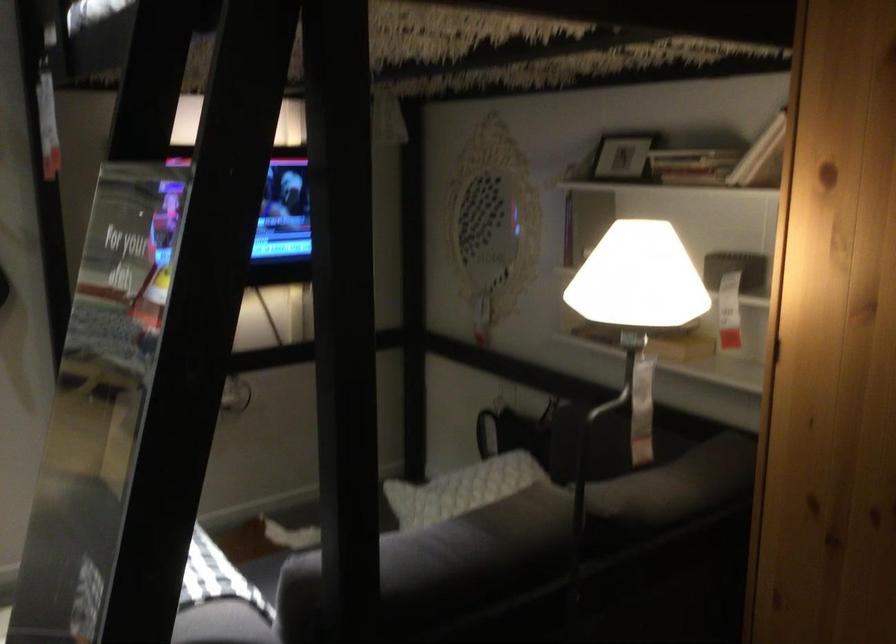
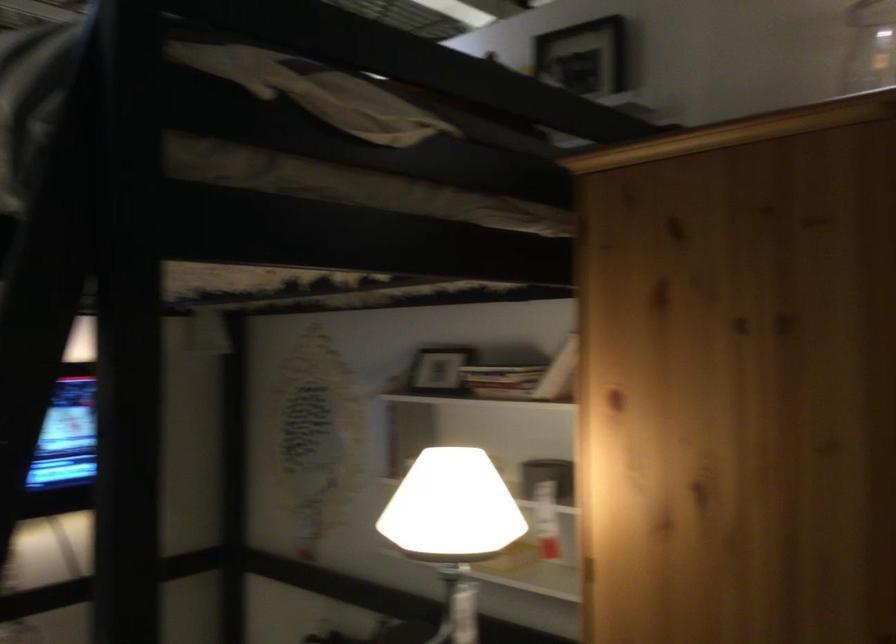
Question: I am providing you with two images of the same scene from different viewpoints. Which of the following objects are not visible in image2?

Choices:
 (A) white table lamp
 (B) stack of books
 (C) small picture frame
 (D) none of these

Answer: (D)